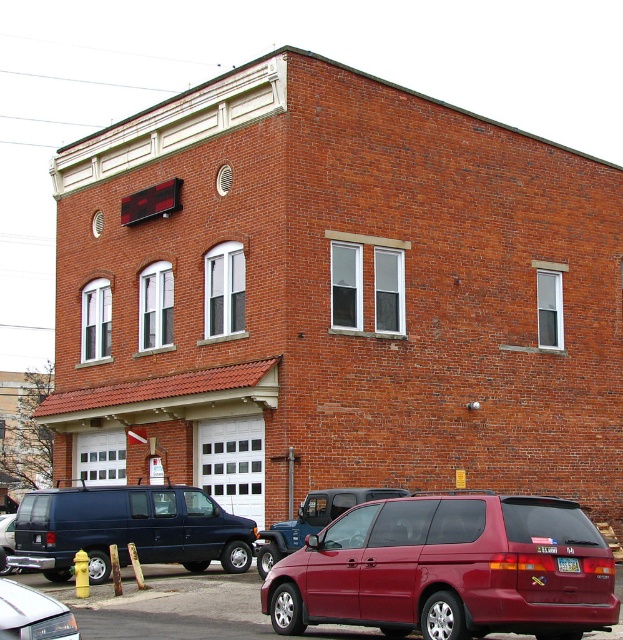
Question: Which object is positioned farthest from the maroon matte minivan at lower right?

Choices:
 (A) maroon matte suv at center
 (B) white glossy sedan at lower left

Answer: (A)

Question: Can you confirm if matte black van at lower left is positioned to the right of white glossy sedan at lower left?

Choices:
 (A) yes
 (B) no

Answer: (B)

Question: Is maroon matte suv at center to the right of white glossy sedan at lower left from the viewer's perspective?

Choices:
 (A) yes
 (B) no

Answer: (A)

Question: Which of the following is the closest to the observer?

Choices:
 (A) white glossy sedan at lower left
 (B) maroon matte minivan at lower right
 (C) matte black van at lower left
 (D) maroon matte suv at center

Answer: (A)

Question: Can you confirm if maroon matte minivan at lower right is positioned below maroon matte suv at center?

Choices:
 (A) no
 (B) yes

Answer: (A)

Question: Which object is closer to the camera taking this photo?

Choices:
 (A) maroon matte minivan at lower right
 (B) matte black van at lower left
 (C) white glossy sedan at lower left
 (D) maroon matte suv at center

Answer: (C)